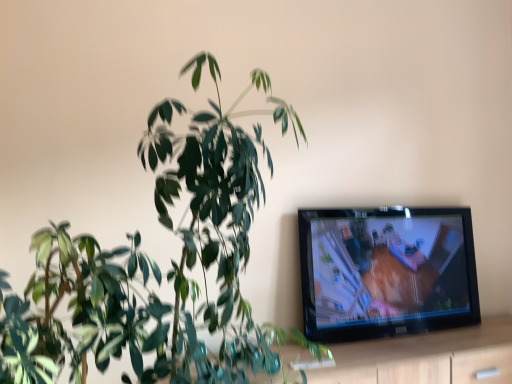
Question: Does green glossy plant at left appear on the right side of light wood dresser at lower right?

Choices:
 (A) no
 (B) yes

Answer: (A)

Question: Are green glossy plant at left and light wood dresser at lower right far apart?

Choices:
 (A) yes
 (B) no

Answer: (B)

Question: Is green glossy plant at left further to the viewer compared to light wood dresser at lower right?

Choices:
 (A) yes
 (B) no

Answer: (B)

Question: Does green glossy plant at left touch light wood dresser at lower right?

Choices:
 (A) yes
 (B) no

Answer: (B)

Question: Can you confirm if green glossy plant at left is wider than light wood dresser at lower right?

Choices:
 (A) no
 (B) yes

Answer: (B)

Question: Is green glossy plant at left positioned with its back to light wood dresser at lower right?

Choices:
 (A) no
 (B) yes

Answer: (A)

Question: Can you confirm if light wood dresser at lower right is thinner than green glossy plant at left?

Choices:
 (A) yes
 (B) no

Answer: (A)

Question: Does light wood dresser at lower right have a smaller size compared to green glossy plant at left?

Choices:
 (A) no
 (B) yes

Answer: (B)

Question: Is the depth of light wood dresser at lower right greater than that of green glossy plant at left?

Choices:
 (A) yes
 (B) no

Answer: (A)

Question: From a real-world perspective, is light wood dresser at lower right on green glossy plant at left?

Choices:
 (A) yes
 (B) no

Answer: (B)

Question: Considering the relative sizes of light wood dresser at lower right and green glossy plant at left in the image provided, is light wood dresser at lower right shorter than green glossy plant at left?

Choices:
 (A) yes
 (B) no

Answer: (A)

Question: From the image's perspective, would you say light wood dresser at lower right is positioned over green glossy plant at left?

Choices:
 (A) no
 (B) yes

Answer: (A)

Question: From a real-world perspective, relative to green glossy plant at left, is light wood dresser at lower right vertically above or below?

Choices:
 (A) below
 (B) above

Answer: (A)